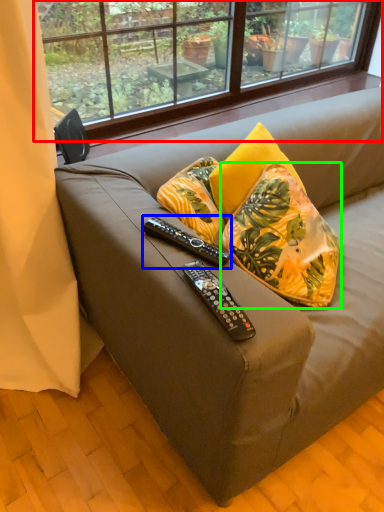
Question: Based on their relative distances, which object is nearer to window (highlighted by a red box)? Choose from remote control (highlighted by a blue box) and pillow (highlighted by a green box).

Choices:
 (A) remote control
 (B) pillow

Answer: (B)